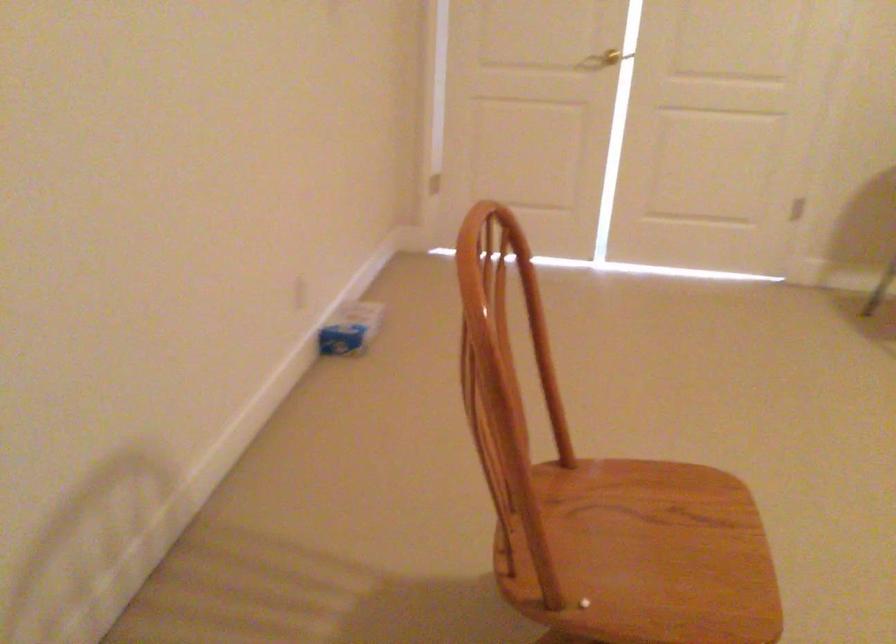
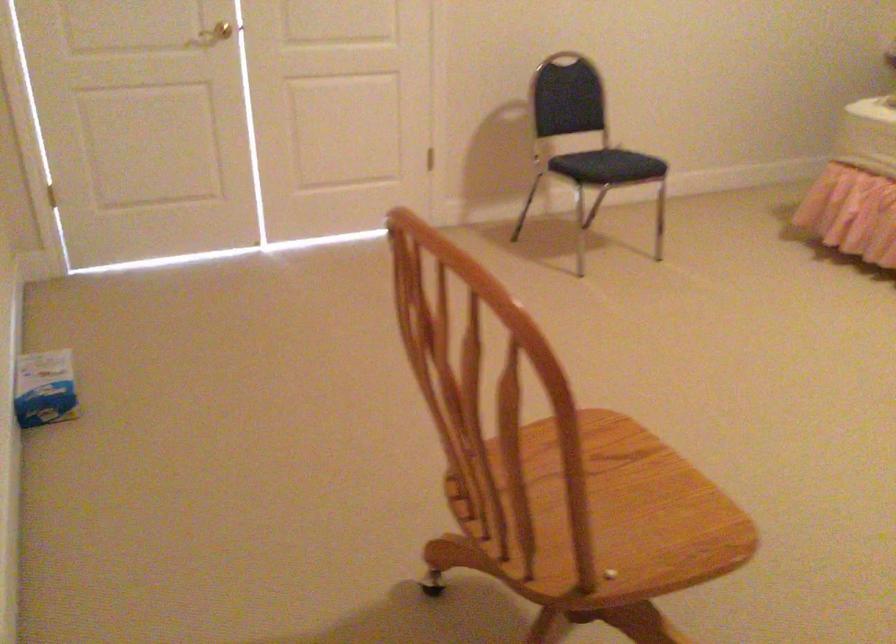
Where in the second image is the point corresponding to point 337,334 from the first image?

(45, 388)